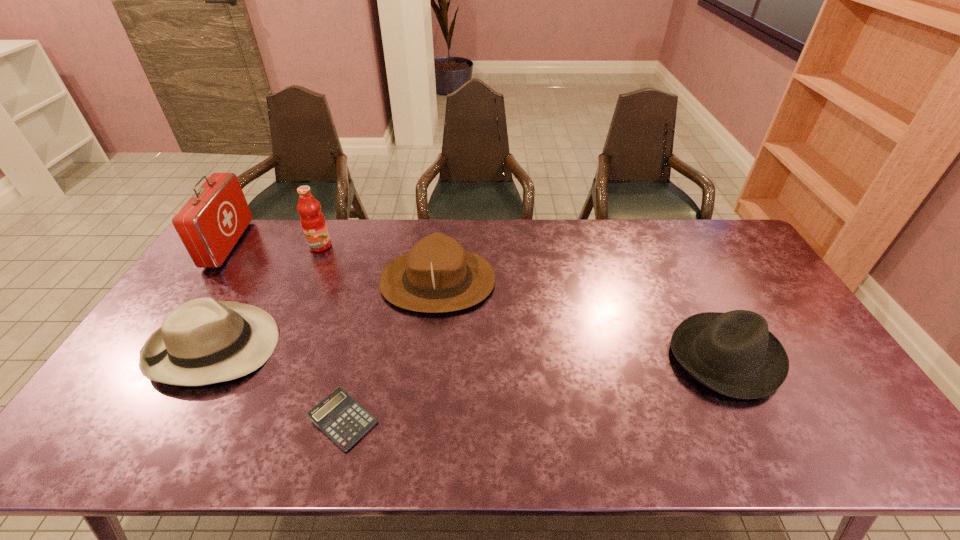
The width and height of the screenshot is (960, 540). Identify the location of free spot that satisfies the following two spatial constraints: 1. on the front label of the calculator; 2. on the right side of the fruit juice. (245, 420).

Where is `free space that satisfies the following two spatial constraints: 1. on the front-facing side of the leftmost fedora; 2. on the back side of the shortest object`? The width and height of the screenshot is (960, 540). free space that satisfies the following two spatial constraints: 1. on the front-facing side of the leftmost fedora; 2. on the back side of the shortest object is located at coordinates (173, 420).

Where is `blank area in the image that satisfies the following two spatial constraints: 1. on the back side of the shortest object; 2. on the side of the first-aid kit with the first aid cross symbol`? The image size is (960, 540). blank area in the image that satisfies the following two spatial constraints: 1. on the back side of the shortest object; 2. on the side of the first-aid kit with the first aid cross symbol is located at coordinates (388, 244).

Identify the location of vacant position in the image that satisfies the following two spatial constraints: 1. on the feather side of the rightmost fedora; 2. on the left side of the second fedora from right to left. This screenshot has width=960, height=540. [430, 356].